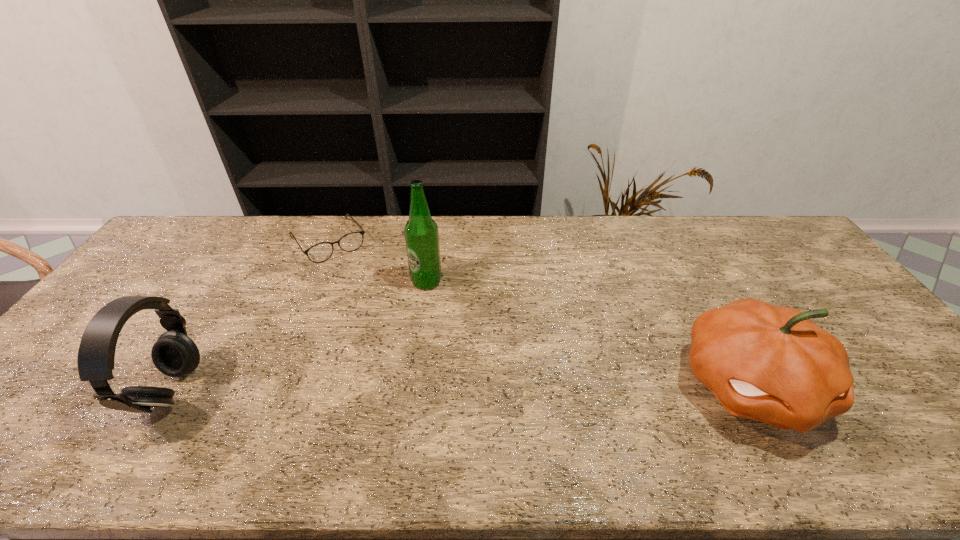
Locate an element on the screen. Image resolution: width=960 pixels, height=540 pixels. vacant spot on the desktop that is between the earphone and the rightmost object and is positioned on the front-facing side of the second object from left to right is located at coordinates (429, 389).

This screenshot has width=960, height=540. Find the location of `free space on the desktop that is between the earphone and the rightmost object and is positioned on the label of the tallest object`. free space on the desktop that is between the earphone and the rightmost object and is positioned on the label of the tallest object is located at coordinates (394, 390).